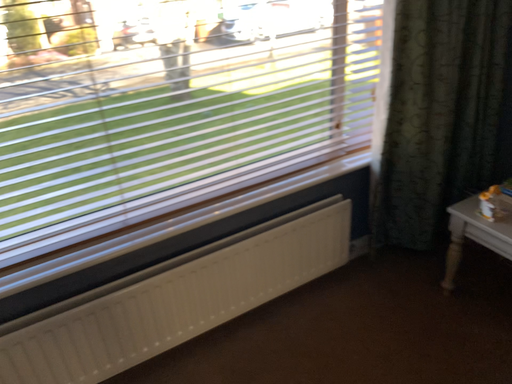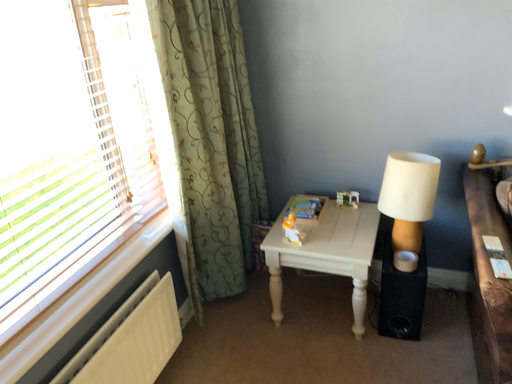
Question: How did the camera likely rotate when shooting the video?

Choices:
 (A) rotated left
 (B) rotated right

Answer: (B)